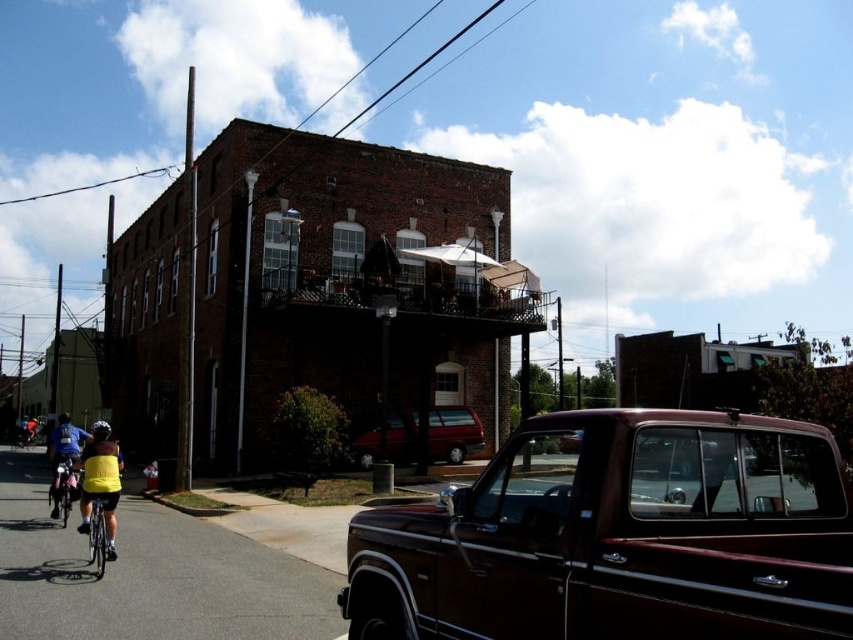
You are standing on the street in front of the building and want to walk towards the two points marked in the image. Which point, point (582,435) or point (97,440), will you reach first?

Point (582,435) is closer to the viewer than point (97,440), so you will reach point (582,435) first.

You are standing in front of the two story brick building and want to take a photo of the red van parked on the street. You notice two points marked in the scene. One is at point (x=722, y=436) and the other is at point (x=112, y=552). Which point should you focus on to ensure the red van is in focus?

You should focus on point (x=722, y=436) because it is closer to the camera than point (x=112, y=552). This will ensure the red van is in focus.

You are a delivery person who needs to park your delivery van between the yellow fabric shirt at lower left and the metallic maroon truck at lower right. Based on the scene, can you determine if there is enough space between them for your van?

The yellow fabric shirt at lower left is wider than the metallic maroon truck at lower right, so there is sufficient space between them to park your delivery van.